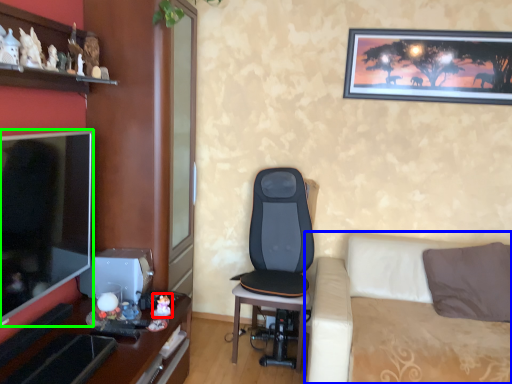
Question: Which object is the farthest from toy (highlighted by a red box)? Choose among these: studio couch (highlighted by a blue box) or television (highlighted by a green box).

Choices:
 (A) studio couch
 (B) television

Answer: (A)